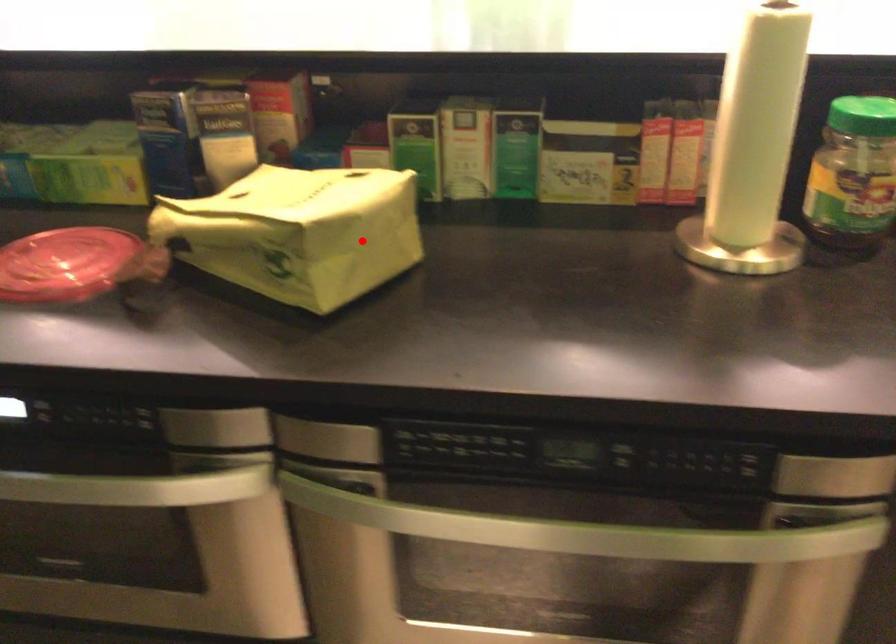
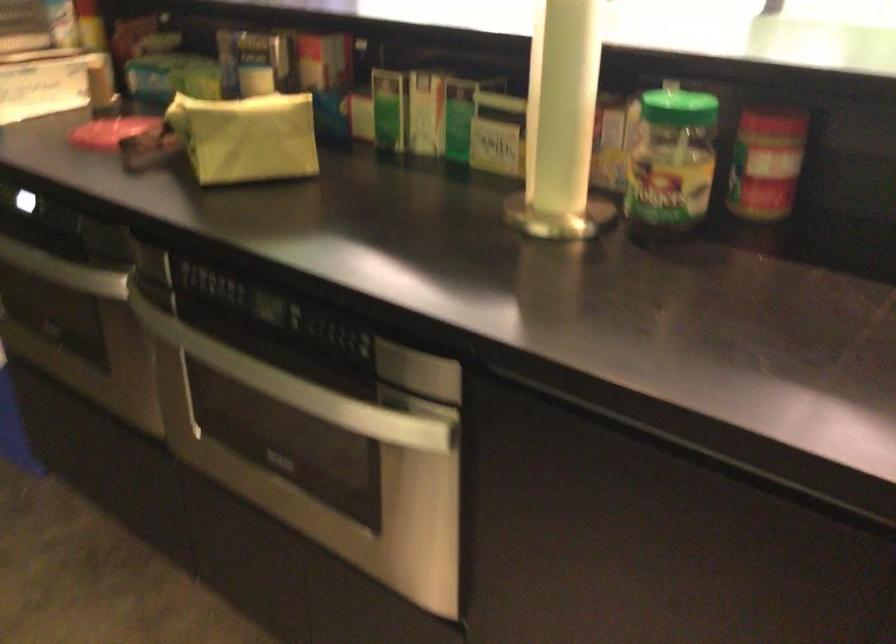
Question: I am providing you with two images of the same scene from different viewpoints. Given a red point in image1, look at the same physical point in image2. Is it:

Choices:
 (A) Closer to the viewpoint
 (B) Farther from the viewpoint

Answer: (B)